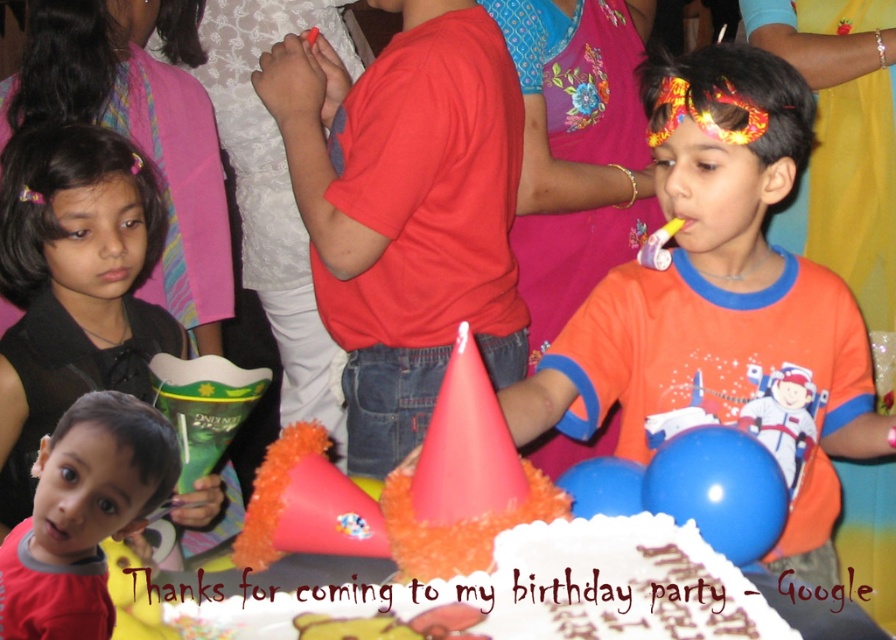
Is white frosted cake at center closer to camera compared to matte red shirt at lower left?

Yes, it is.

Which is above, white frosted cake at center or matte red shirt at lower left?

Positioned higher is white frosted cake at center.

Identify the location of white frosted cake at center. (397, 496).

Find the location of a particular element. white frosted cake at center is located at coordinates (397, 496).

Does orange cotton shirt at center lie in front of matte red shirt at lower left?

No, orange cotton shirt at center is behind matte red shirt at lower left.

Can you confirm if orange cotton shirt at center is positioned to the right of matte red shirt at lower left?

Correct, you'll find orange cotton shirt at center to the right of matte red shirt at lower left.

Is point (744, 132) positioned before point (135, 500)?

No.

You are a GUI agent. You are given a task and a screenshot of the screen. Output one action in this format:
    pyautogui.click(x=<x>, y=<y>)
    Task: Click on the orange cotton shirt at center
    The width and height of the screenshot is (896, 640).
    Given the screenshot: What is the action you would take?
    pyautogui.click(x=722, y=305)

Does orange cotton shirt at center have a lesser height compared to white frosted cake at center?

No.

Is orange cotton shirt at center below white frosted cake at center?

Actually, orange cotton shirt at center is above white frosted cake at center.

Between point (617, 378) and point (718, 632), which one is positioned behind?

Point (617, 378)

Identify the location of orange cotton shirt at center. Image resolution: width=896 pixels, height=640 pixels. (722, 305).